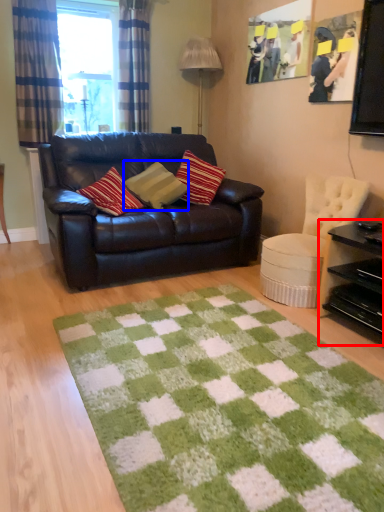
Question: Which point is closer to the camera, table (highlighted by a red box) or pillow (highlighted by a blue box)?

Choices:
 (A) table
 (B) pillow

Answer: (A)